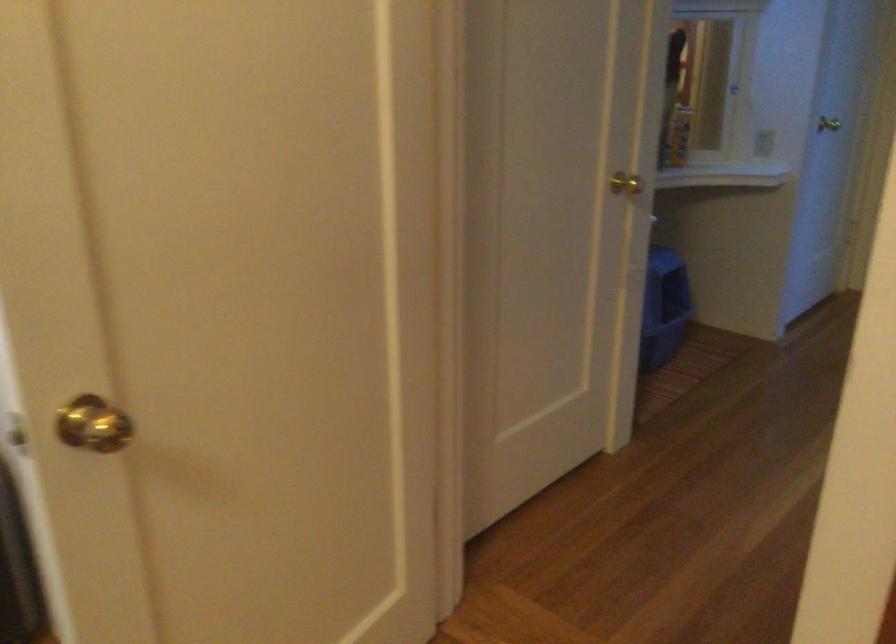
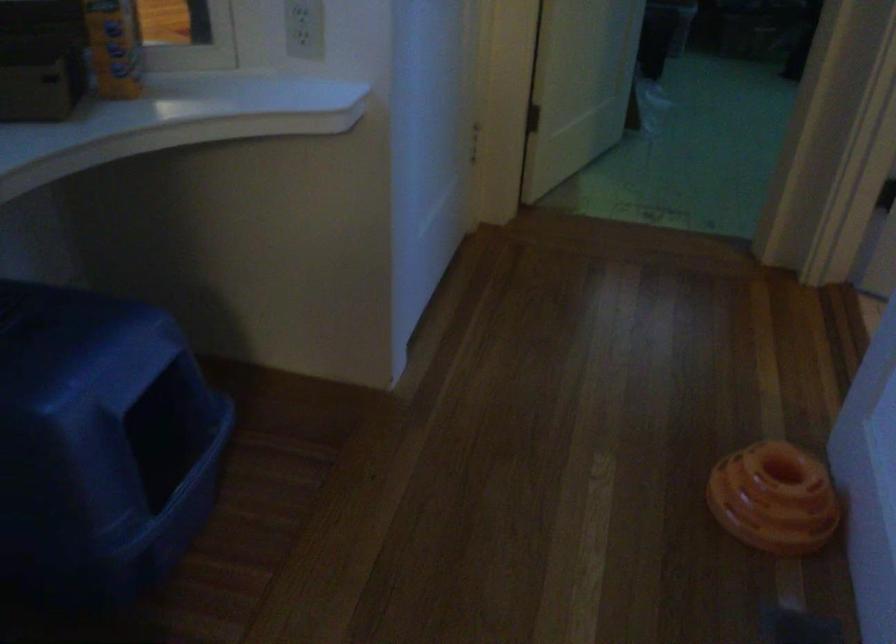
In the second image, find the point that corresponds to point 673,140 in the first image.

(114, 46)